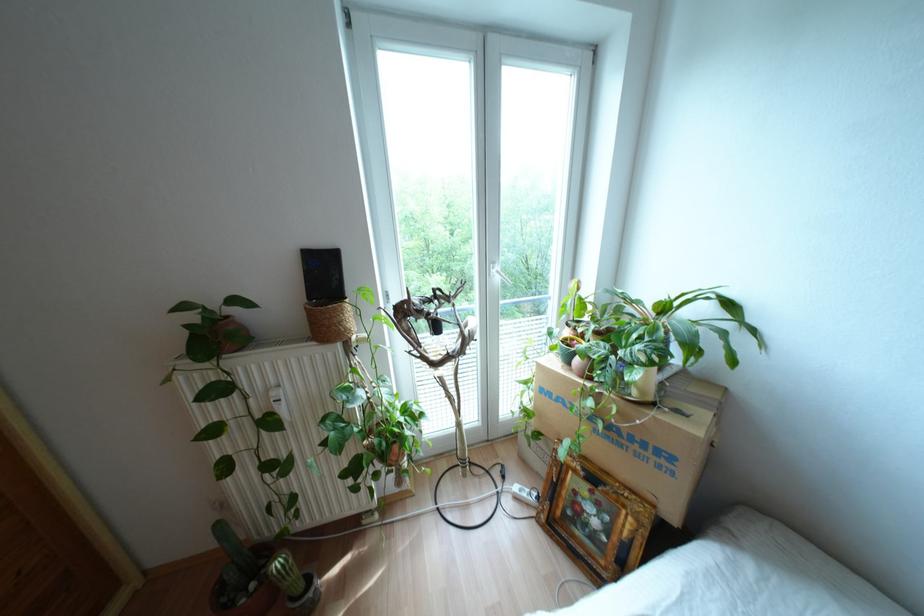
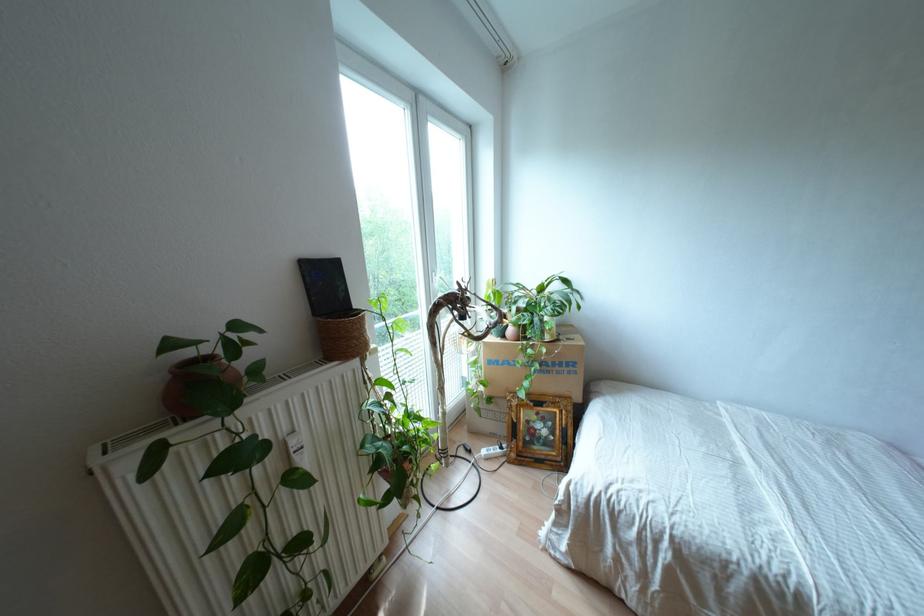
Where in the second image is the point corresponding to (280,400) from the first image?

(301, 448)